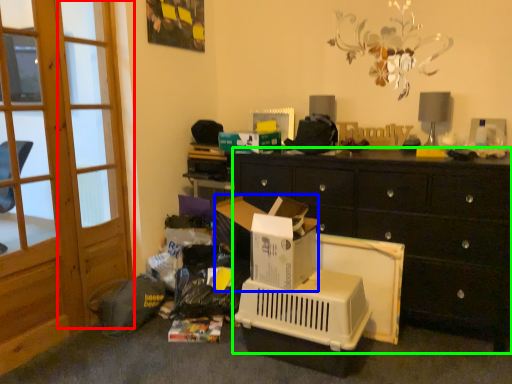
Question: Based on their relative distances, which object is farther from screen door (highlighted by a red box)? Choose from cardboard box (highlighted by a blue box) and cabinetry (highlighted by a green box).

Choices:
 (A) cardboard box
 (B) cabinetry

Answer: (B)